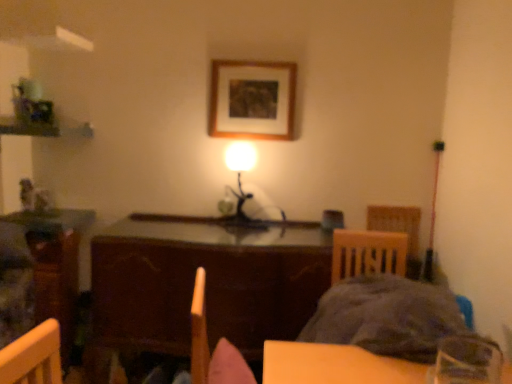
Question: Is the depth of wooden table at left, the second table viewed from the right, less than that of matte brown armchair at center?

Choices:
 (A) yes
 (B) no

Answer: (B)

Question: Considering the relative sizes of wooden table at left, which is counted as the first table, starting from the left, and matte brown armchair at center in the image provided, is wooden table at left, which is counted as the first table, starting from the left, thinner than matte brown armchair at center?

Choices:
 (A) no
 (B) yes

Answer: (A)

Question: Is wooden table at left, which is counted as the first table, starting from the left, shorter than matte brown armchair at center?

Choices:
 (A) yes
 (B) no

Answer: (B)

Question: From a real-world perspective, is wooden table at left, the second table viewed from the right, physically above matte brown armchair at center?

Choices:
 (A) yes
 (B) no

Answer: (B)

Question: Would you say wooden table at left, which is counted as the first table, starting from the left, contains matte brown armchair at center?

Choices:
 (A) yes
 (B) no

Answer: (B)

Question: From a real-world perspective, is fluffy gray blanket at lower right positioned above or below wooden table at center, which appears as the 2th table when viewed from the left?

Choices:
 (A) above
 (B) below

Answer: (A)

Question: Would you say fluffy gray blanket at lower right is inside or outside wooden table at center, which is the first table from right to left?

Choices:
 (A) inside
 (B) outside

Answer: (B)

Question: Is point (409, 354) closer or farther from the camera than point (288, 238)?

Choices:
 (A) farther
 (B) closer

Answer: (B)

Question: Considering the positions of fluffy gray blanket at lower right and wooden table at center, which appears as the 2th table when viewed from the left, in the image, is fluffy gray blanket at lower right bigger or smaller than wooden table at center, which appears as the 2th table when viewed from the left,?

Choices:
 (A) big
 (B) small

Answer: (B)

Question: From the image's perspective, relative to wooden picture frame at upper center, is wooden table at center, which is the first table from right to left, above or below?

Choices:
 (A) above
 (B) below

Answer: (B)

Question: Is wooden table at center, which is the first table from right to left, taller or shorter than wooden picture frame at upper center?

Choices:
 (A) short
 (B) tall

Answer: (B)

Question: From a real-world perspective, is wooden table at center, which is the first table from right to left, physically located above or below wooden picture frame at upper center?

Choices:
 (A) below
 (B) above

Answer: (A)

Question: Visually, is wooden table at center, which appears as the 2th table when viewed from the left, positioned to the left or to the right of wooden picture frame at upper center?

Choices:
 (A) right
 (B) left

Answer: (B)

Question: Is fluffy gray blanket at lower right in front of or behind wooden picture frame at upper center in the image?

Choices:
 (A) behind
 (B) front

Answer: (B)

Question: From the image's perspective, is fluffy gray blanket at lower right located above or below wooden picture frame at upper center?

Choices:
 (A) below
 (B) above

Answer: (A)